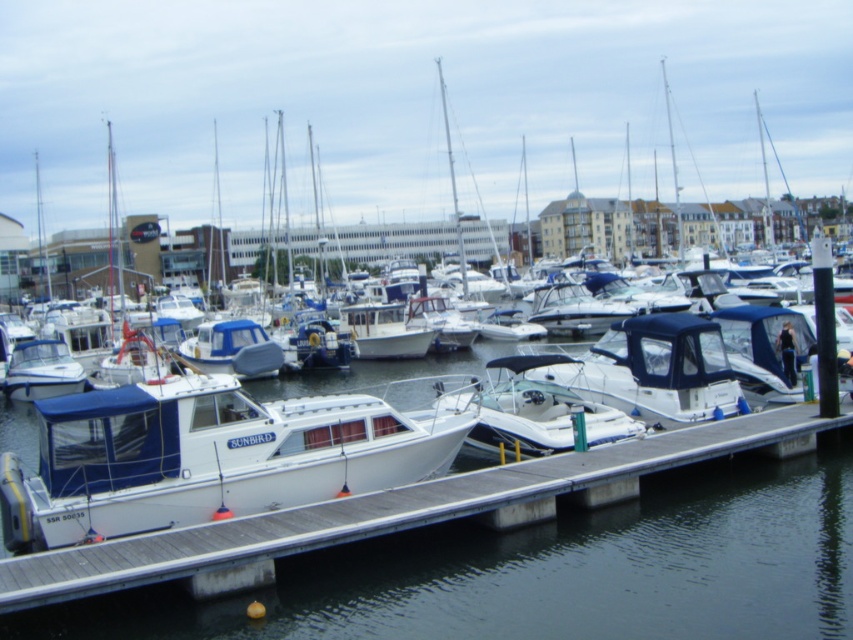
You are a boat owner who wants to dock your new boat at the marina. You see the white wood dock at center and the white matte boat at center. Which one is larger in size?

The white wood dock at center is bigger than the white matte boat at center.

You are a boat operator who needs to maneuver a new boat into the marina. You see the white wood dock at center and the white matte boat at center. Based on their widths, which one is wider?

The white wood dock at center is wider than the white matte boat at center according to the description.